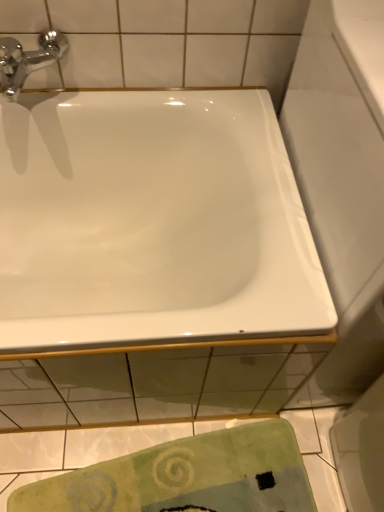
Question: Is white glossy bathtub at upper center closer to the viewer compared to green textured towel at lower center?

Choices:
 (A) yes
 (B) no

Answer: (A)

Question: Is white glossy bathtub at upper center wider than green textured towel at lower center?

Choices:
 (A) yes
 (B) no

Answer: (A)

Question: Can you see white glossy bathtub at upper center touching green textured towel at lower center?

Choices:
 (A) yes
 (B) no

Answer: (B)

Question: Is green textured towel at lower center at the back of white glossy bathtub at upper center?

Choices:
 (A) no
 (B) yes

Answer: (A)

Question: From the image's perspective, would you say white glossy bathtub at upper center is shown under green textured towel at lower center?

Choices:
 (A) no
 (B) yes

Answer: (A)

Question: Is chrome/metallic faucet at upper left inside the boundaries of green textured towel at lower center, or outside?

Choices:
 (A) outside
 (B) inside

Answer: (A)

Question: From a real-world perspective, relative to green textured towel at lower center, is chrome/metallic faucet at upper left vertically above or below?

Choices:
 (A) above
 (B) below

Answer: (A)

Question: In the image, is chrome/metallic faucet at upper left positioned in front of or behind green textured towel at lower center?

Choices:
 (A) front
 (B) behind

Answer: (A)

Question: In the image, is chrome/metallic faucet at upper left on the left side or the right side of green textured towel at lower center?

Choices:
 (A) left
 (B) right

Answer: (A)

Question: Is green textured towel at lower center taller or shorter than chrome/metallic faucet at upper left?

Choices:
 (A) short
 (B) tall

Answer: (A)

Question: Is green textured towel at lower center in front of or behind chrome/metallic faucet at upper left in the image?

Choices:
 (A) behind
 (B) front

Answer: (A)

Question: From the image's perspective, is green textured towel at lower center located above or below chrome/metallic faucet at upper left?

Choices:
 (A) below
 (B) above

Answer: (A)

Question: Based on their sizes in the image, would you say green textured towel at lower center is bigger or smaller than chrome/metallic faucet at upper left?

Choices:
 (A) big
 (B) small

Answer: (A)

Question: From a real-world perspective, is green textured towel at lower center positioned above or below white glossy bathtub at upper center?

Choices:
 (A) above
 (B) below

Answer: (B)

Question: In the image, is green textured towel at lower center positioned in front of or behind white glossy bathtub at upper center?

Choices:
 (A) behind
 (B) front

Answer: (A)